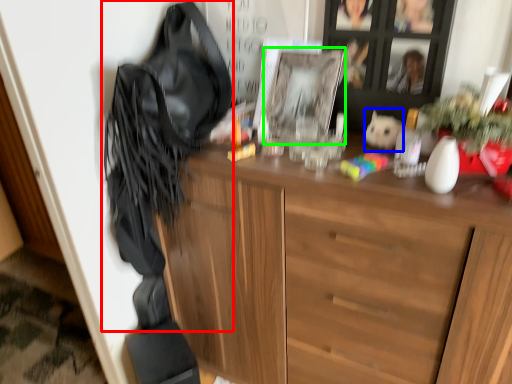
Question: Considering the real-world distances, which object is farthest from shoulder bag (highlighted by a red box)? animal (highlighted by a blue box) or picture frame (highlighted by a green box)?

Choices:
 (A) animal
 (B) picture frame

Answer: (A)